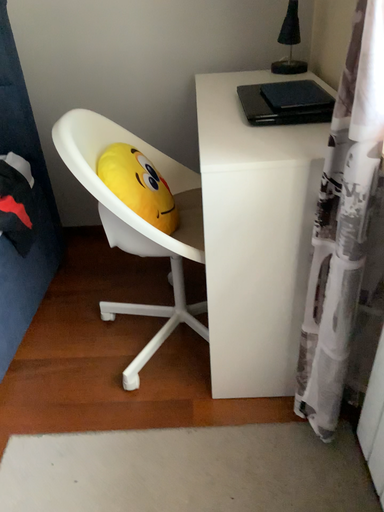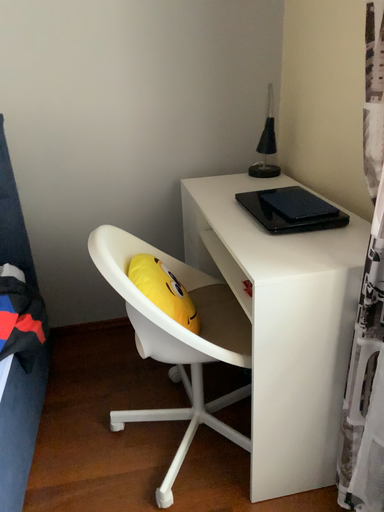
Question: How did the camera likely rotate when shooting the video?

Choices:
 (A) rotated right
 (B) rotated left

Answer: (A)